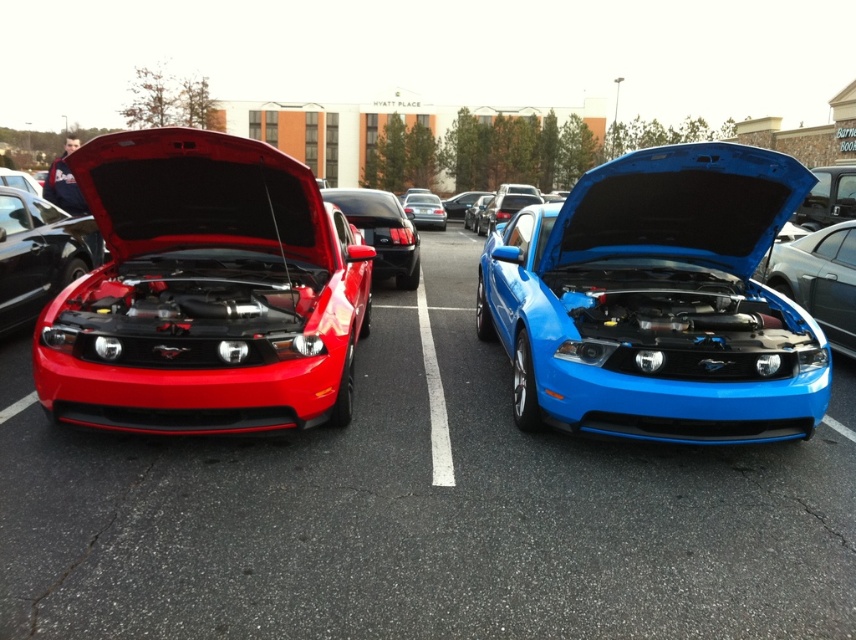
Question: Which of the following is the farthest from the observer?

Choices:
 (A) shiny red car at center
 (B) matte black car at left
 (C) shiny red car at left
 (D) satin silver sedan at center

Answer: (D)

Question: Which is nearer to the shiny red car at center?

Choices:
 (A) shiny red car at left
 (B) shiny blue car at center
 (C) matte black car at left
 (D) satin silver sedan at center

Answer: (C)

Question: Which object is closer to the camera taking this photo?

Choices:
 (A) satin silver sedan at center
 (B) matte black car at left
 (C) shiny red car at center

Answer: (C)

Question: Is shiny blue car at center below satin silver sedan at center?

Choices:
 (A) yes
 (B) no

Answer: (A)

Question: Is shiny red car at center thinner than matte black car at left?

Choices:
 (A) no
 (B) yes

Answer: (B)

Question: Is shiny blue car at center wider than glossy black car at center?

Choices:
 (A) yes
 (B) no

Answer: (A)